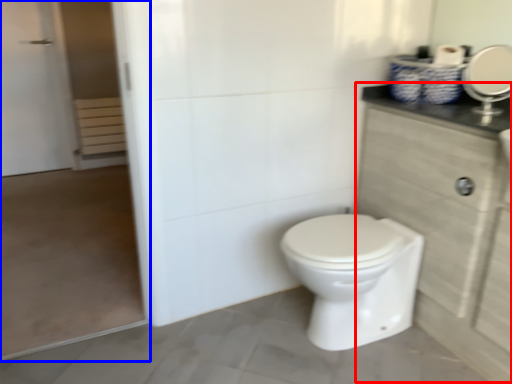
Question: Which point is further to the camera, dresser (highlighted by a red box) or screen door (highlighted by a blue box)?

Choices:
 (A) dresser
 (B) screen door

Answer: (B)